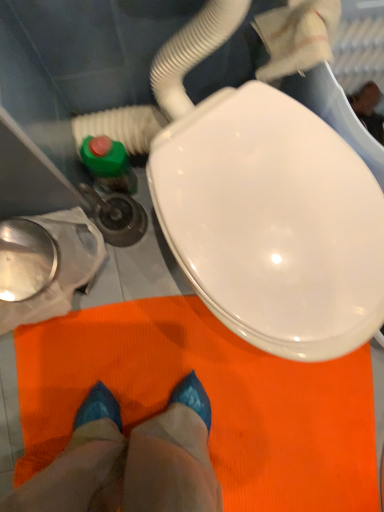
Question: Can you confirm if blue glossy shoes at center is thinner than green plastic water pipe at left?

Choices:
 (A) yes
 (B) no

Answer: (B)

Question: Is blue glossy shoes at center oriented towards green plastic water pipe at left?

Choices:
 (A) no
 (B) yes

Answer: (A)

Question: Is the position of blue glossy shoes at center more distant than that of green plastic water pipe at left?

Choices:
 (A) yes
 (B) no

Answer: (A)

Question: Does blue glossy shoes at center contain green plastic water pipe at left?

Choices:
 (A) yes
 (B) no

Answer: (B)

Question: Is blue glossy shoes at center smaller than green plastic water pipe at left?

Choices:
 (A) no
 (B) yes

Answer: (A)

Question: Is blue glossy shoes at center to the left of green plastic water pipe at left from the viewer's perspective?

Choices:
 (A) no
 (B) yes

Answer: (A)

Question: From the image's perspective, would you say green plastic water pipe at left is positioned over blue glossy shoes at center?

Choices:
 (A) yes
 (B) no

Answer: (A)

Question: Does green plastic water pipe at left have a larger size compared to blue glossy shoes at center?

Choices:
 (A) no
 (B) yes

Answer: (A)

Question: Is green plastic water pipe at left turned away from blue glossy shoes at center?

Choices:
 (A) yes
 (B) no

Answer: (B)

Question: From a real-world perspective, is green plastic water pipe at left physically above blue glossy shoes at center?

Choices:
 (A) yes
 (B) no

Answer: (A)

Question: Can you confirm if green plastic water pipe at left is positioned to the right of blue glossy shoes at center?

Choices:
 (A) no
 (B) yes

Answer: (A)

Question: Considering the relative positions of green plastic water pipe at left and blue glossy shoes at center in the image provided, is green plastic water pipe at left to the left of blue glossy shoes at center from the viewer's perspective?

Choices:
 (A) yes
 (B) no

Answer: (A)

Question: From a real-world perspective, is green plastic water pipe at left positioned above or below blue glossy shoes at center?

Choices:
 (A) below
 (B) above

Answer: (B)